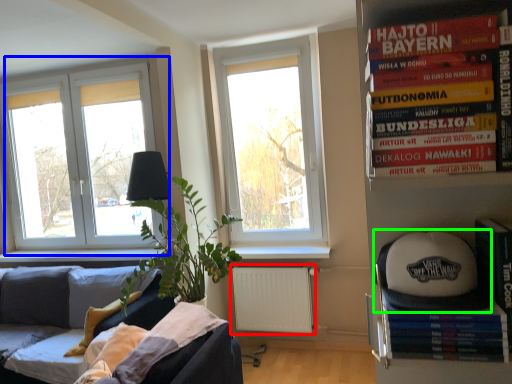
Question: Which is nearer to the radiator (highlighted by a red box)? window (highlighted by a blue box) or baseball hat (highlighted by a green box).

Choices:
 (A) window
 (B) baseball hat

Answer: (A)